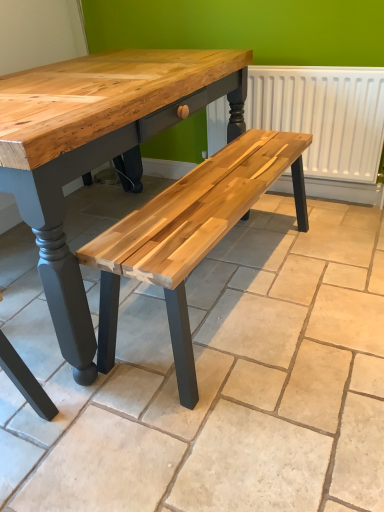
The image size is (384, 512). Find the location of `free location in front of white matte radiator at upper right`. free location in front of white matte radiator at upper right is located at coordinates (299, 239).